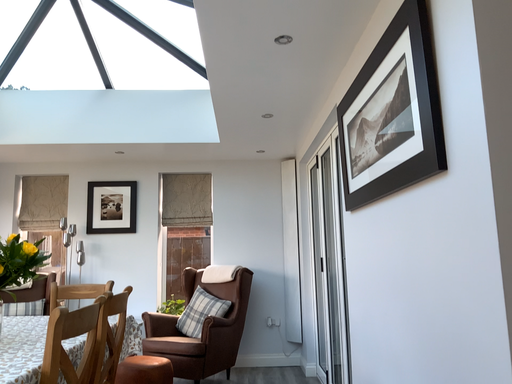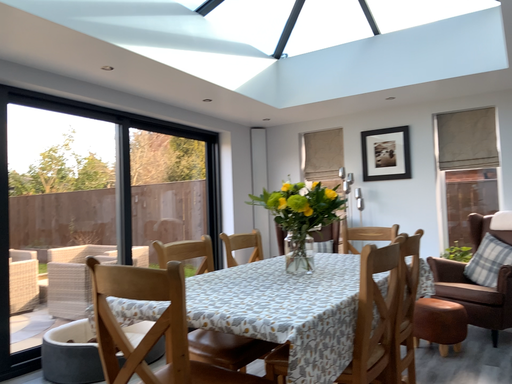
Question: Which way did the camera rotate in the video?

Choices:
 (A) rotated right
 (B) rotated left

Answer: (B)